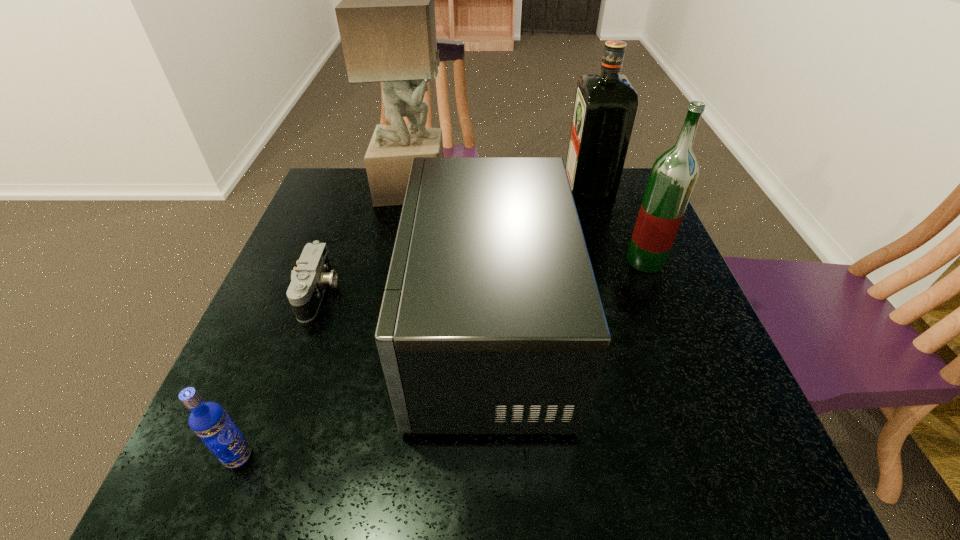
Where is `the tallest object`? The height and width of the screenshot is (540, 960). the tallest object is located at coordinates (386, 19).

The image size is (960, 540). I want to click on the farther liquor, so click(605, 108).

What are the coordinates of `the nearer liquor` in the screenshot? It's located at (674, 174).

Where is `microwave oven`? This screenshot has width=960, height=540. microwave oven is located at coordinates (491, 322).

I want to click on vodka, so click(209, 421).

At what (x,y) coordinates should I click in order to perform the action: click on the fifth tallest object. Please return your answer as a coordinate pair (x, y). Looking at the image, I should click on (209, 421).

At what (x,y) coordinates should I click in order to perform the action: click on camera. Please return your answer as a coordinate pair (x, y). Looking at the image, I should click on (309, 280).

Identify the location of free space located 0.380m on the front-facing side of the tallest object. This screenshot has height=540, width=960. (572, 188).

You are a GUI agent. You are given a task and a screenshot of the screen. Output one action in this format:
    pyautogui.click(x=<x>, y=<y>)
    Task: Click on the vacant space located on the front label of the farther liquor
    
    Given the screenshot: What is the action you would take?
    pyautogui.click(x=540, y=190)

You are a GUI agent. You are given a task and a screenshot of the screen. Output one action in this format:
    pyautogui.click(x=<x>, y=<y>)
    Task: Click on the free space located 0.120m on the front label of the farther liquor
    
    Given the screenshot: What is the action you would take?
    pyautogui.click(x=527, y=190)